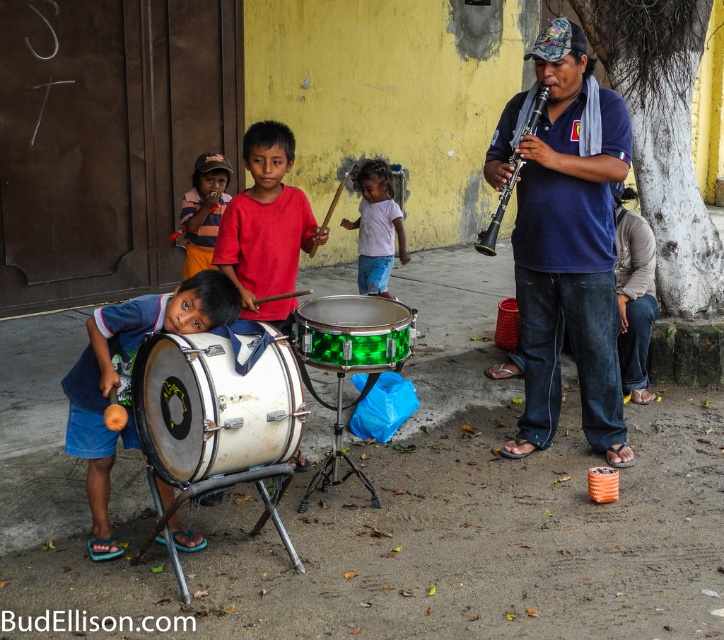
Measure the distance between point (x=140, y=353) and camera.

A distance of 3.43 meters exists between point (x=140, y=353) and camera.

Is white matte drum at lower left wider than matte white drum at lower left?

No, white matte drum at lower left is not wider than matte white drum at lower left.

Identify the location of white matte drum at lower left. The width and height of the screenshot is (724, 640). (214, 401).

Between white matte drum at lower left and green glossy drum at center, which one is positioned lower?

Positioned lower is white matte drum at lower left.

Consider the image. Can you confirm if white matte drum at lower left is wider than green glossy drum at center?

Indeed, white matte drum at lower left has a greater width compared to green glossy drum at center.

Is point (214, 406) closer to viewer compared to point (383, 310)?

Yes.

You are a GUI agent. You are given a task and a screenshot of the screen. Output one action in this format:
    pyautogui.click(x=<x>, y=<y>)
    Task: Click on the white matte drum at lower left
    This screenshot has width=724, height=640.
    Given the screenshot: What is the action you would take?
    pyautogui.click(x=214, y=401)

Is point (177, 364) farther from camera compared to point (214, 208)?

No.

Is white matte drum at lower left to the right of striped cotton shirt at center from the viewer's perspective?

Indeed, white matte drum at lower left is positioned on the right side of striped cotton shirt at center.

Is point (258, 392) positioned in front of point (197, 264)?

Yes, it is.

Identify the location of white matte drum at lower left. (x=214, y=401).